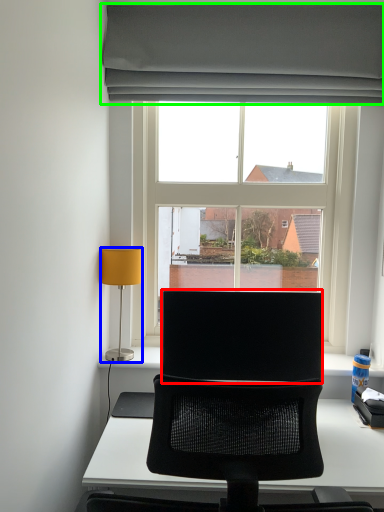
Question: Which object is the closest to the computer monitor (highlighted by a red box)? Choose among these: lamp (highlighted by a blue box) or curtain (highlighted by a green box).

Choices:
 (A) lamp
 (B) curtain

Answer: (A)